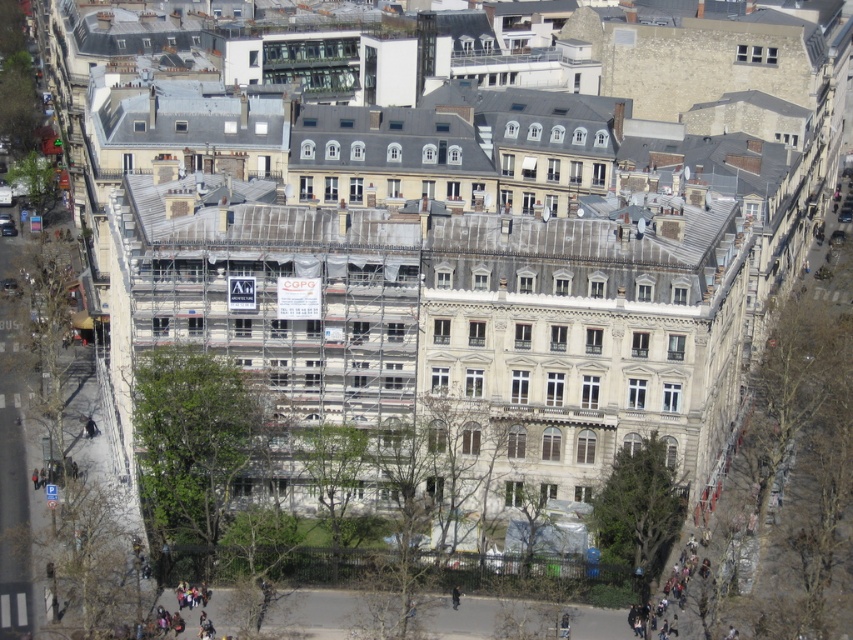
You are a delivery person needing to reach the dark gray jacket at center from the dark gray concrete stairs at lower right. Can you walk directly to it without any obstacles?

The dark gray concrete stairs at lower right and dark gray jacket at center are 30.81 feet apart from each other, so yes, you can walk directly to the dark gray jacket at center without any obstacles as there is enough space between them.

You are a construction worker standing at the center of the main building. You need to reach the dark gray concrete stairs at lower right. Which direction should you walk to get there?

You should walk towards the lower right direction to reach the dark gray concrete stairs at lower right.